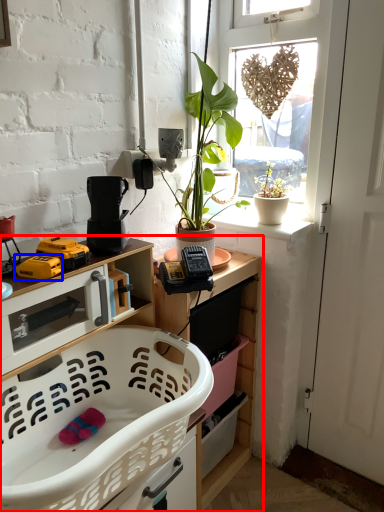
Question: Which of the following is the closest to the observer, cabinetry (highlighted by a red box) or toy (highlighted by a blue box)?

Choices:
 (A) cabinetry
 (B) toy

Answer: (A)